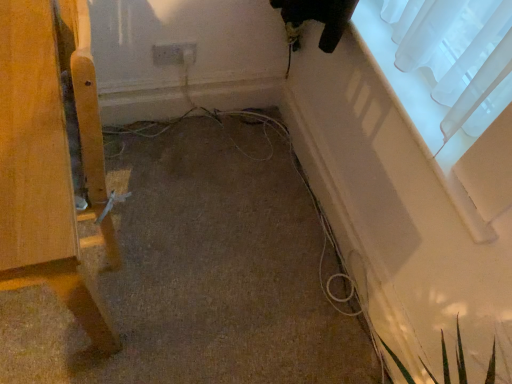
Where is `white plastic electric outlet at center`? This screenshot has width=512, height=384. white plastic electric outlet at center is located at coordinates (174, 54).

Identify the location of transparent fabric at upper right. The height and width of the screenshot is (384, 512). (401, 74).

Does white plastic electric outlet at center have a greater width compared to transparent fabric at upper right?

No, white plastic electric outlet at center is not wider than transparent fabric at upper right.

Considering the relative sizes of white plastic electric outlet at center and transparent fabric at upper right in the image provided, is white plastic electric outlet at center shorter than transparent fabric at upper right?

No, white plastic electric outlet at center is not shorter than transparent fabric at upper right.

Where is `electric outlet that is behind the transparent fabric at upper right`? electric outlet that is behind the transparent fabric at upper right is located at coordinates (174, 54).

Between point (159, 56) and point (356, 23), which one is positioned behind?

Positioned behind is point (159, 56).

Does transparent fabric at upper right turn towards wooden chair leg at left?

Yes, transparent fabric at upper right is turned towards wooden chair leg at left.

Does point (396, 84) appear closer or farther from the camera than point (69, 17)?

Point (396, 84) is farther from the camera than point (69, 17).

The width and height of the screenshot is (512, 384). What are the coordinates of `window located on the right of wooden chair leg at left` in the screenshot? It's located at (401, 74).

Considering the sizes of objects transparent fabric at upper right and wooden chair leg at left in the image provided, who is wider, transparent fabric at upper right or wooden chair leg at left?

wooden chair leg at left.

Is point (47, 211) closer or farther from the camera than point (172, 48)?

Clearly, point (47, 211) is closer to the camera than point (172, 48).

Considering the sizes of objects wooden chair leg at left and white plastic electric outlet at center in the image provided, who is thinner, wooden chair leg at left or white plastic electric outlet at center?

white plastic electric outlet at center.

Based on the photo, do you think wooden chair leg at left is within white plastic electric outlet at center, or outside of it?

The correct answer is: outside.

Considering the relative sizes of wooden chair leg at left and white plastic electric outlet at center in the image provided, is wooden chair leg at left smaller than white plastic electric outlet at center?

Incorrect, wooden chair leg at left is not smaller in size than white plastic electric outlet at center.

In the image, is wooden chair leg at left positioned in front of or behind transparent fabric at upper right?

Clearly, wooden chair leg at left is in front of transparent fabric at upper right.

This screenshot has width=512, height=384. Identify the location of window located above the wooden chair leg at left (from the image's perspective). (401, 74).

Can we say wooden chair leg at left lies outside transparent fabric at upper right?

Absolutely, wooden chair leg at left is external to transparent fabric at upper right.

From the image's perspective, relative to white plastic electric outlet at center, is transparent fabric at upper right above or below?

Clearly, from the image's perspective, transparent fabric at upper right is below white plastic electric outlet at center.

From a real-world perspective, is transparent fabric at upper right over white plastic electric outlet at center?

Yes, from a real-world perspective, transparent fabric at upper right is on top of white plastic electric outlet at center.

Which of these two, transparent fabric at upper right or white plastic electric outlet at center, is thinner?

white plastic electric outlet at center is thinner.

In terms of width, does white plastic electric outlet at center look wider or thinner when compared to wooden chair leg at left?

In the image, white plastic electric outlet at center appears to be more narrow than wooden chair leg at left.

Is white plastic electric outlet at center shorter than wooden chair leg at left?

Indeed, white plastic electric outlet at center has a lesser height compared to wooden chair leg at left.

Does point (185, 49) appear closer or farther from the camera than point (11, 32)?

Clearly, point (185, 49) is more distant from the camera than point (11, 32).

Which object is closer to the camera, white plastic electric outlet at center or wooden chair leg at left?

wooden chair leg at left is closer to the camera.

At what (x,y) coordinates should I click in order to perform the action: click on electric outlet behind the transparent fabric at upper right. Please return your answer as a coordinate pair (x, y). Image resolution: width=512 pixels, height=384 pixels. Looking at the image, I should click on (174, 54).

Identify the location of furniture in front of the transparent fabric at upper right. The height and width of the screenshot is (384, 512). (48, 155).

Which object lies further to the anchor point transparent fabric at upper right, wooden chair leg at left or white plastic electric outlet at center?

wooden chair leg at left is further to transparent fabric at upper right.

From the image, which object appears to be nearer to white plastic electric outlet at center, wooden chair leg at left or transparent fabric at upper right?

transparent fabric at upper right.

Estimate the real-world distances between objects in this image. Which object is closer to transparent fabric at upper right, white plastic electric outlet at center or wooden chair leg at left?

Based on the image, white plastic electric outlet at center appears to be nearer to transparent fabric at upper right.

Looking at the image, which one is located closer to wooden chair leg at left, transparent fabric at upper right or white plastic electric outlet at center?

The object closer to wooden chair leg at left is transparent fabric at upper right.

When comparing their distances from wooden chair leg at left, does white plastic electric outlet at center or transparent fabric at upper right seem further?

white plastic electric outlet at center.

Consider the image. From the image, which object appears to be nearer to white plastic electric outlet at center, transparent fabric at upper right or wooden chair leg at left?

Among the two, transparent fabric at upper right is located nearer to white plastic electric outlet at center.

Find the location of `electric outlet situated between wooden chair leg at left and transparent fabric at upper right from left to right`. electric outlet situated between wooden chair leg at left and transparent fabric at upper right from left to right is located at coordinates (174, 54).